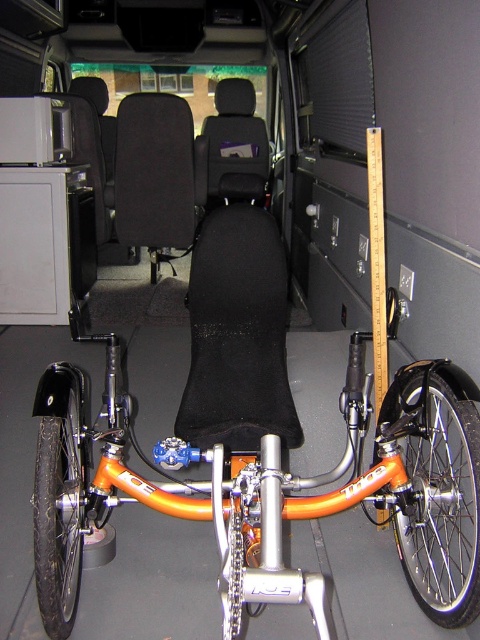
Question: Which object is the farthest from the orange metallic bicycle at center?

Choices:
 (A) orange metallic/reflective wheel at lower right
 (B) black rubber tire at left

Answer: (B)

Question: Which point is farther to the camera?

Choices:
 (A) (208, 358)
 (B) (406, 397)

Answer: (A)

Question: Is orange metallic bicycle at center to the right of black fabric seat at center from the viewer's perspective?

Choices:
 (A) yes
 (B) no

Answer: (A)

Question: Is black fabric seat at center bigger than orange metallic/reflective wheel at lower right?

Choices:
 (A) yes
 (B) no

Answer: (A)

Question: Which point is closer to the camera?

Choices:
 (A) (411, 384)
 (B) (79, 392)

Answer: (A)

Question: Can you confirm if black fabric seat at center is bigger than orange metallic/reflective wheel at lower right?

Choices:
 (A) no
 (B) yes

Answer: (B)